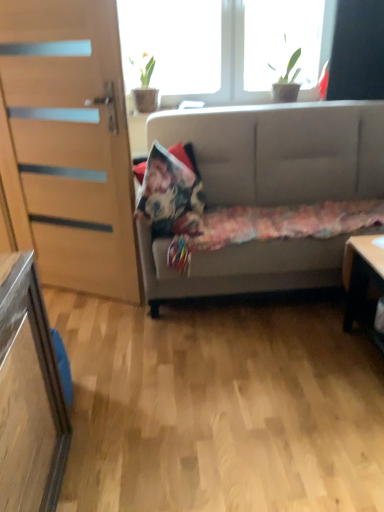
Image resolution: width=384 pixels, height=512 pixels. I want to click on free location in front of wooden door at left, so click(x=93, y=329).